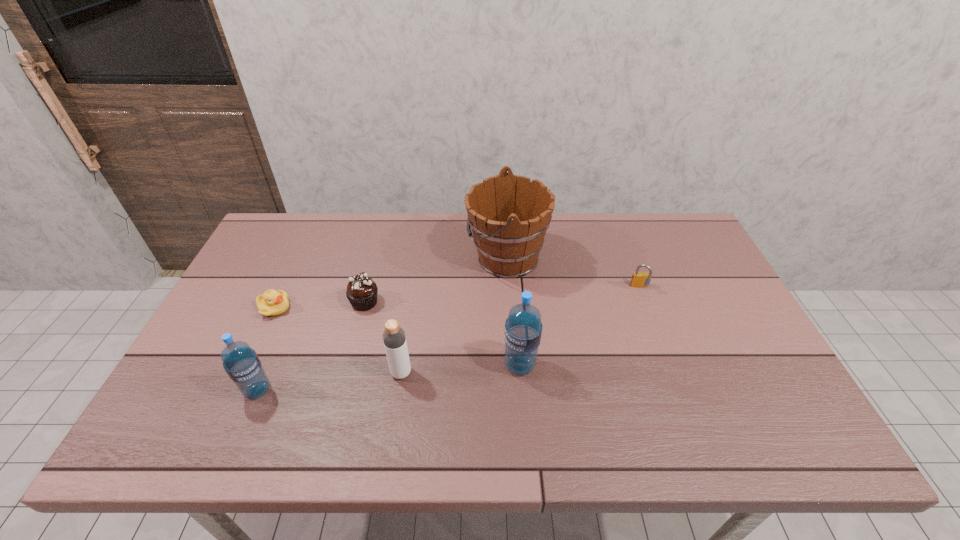
Image resolution: width=960 pixels, height=540 pixels. In order to click on free space located 0.300m with the handle on the wine bucket in this screenshot , I will do `click(372, 258)`.

Where is `vacant region located with the handle on the wine bucket`? The image size is (960, 540). vacant region located with the handle on the wine bucket is located at coordinates (416, 258).

Locate an element on the screen. Image resolution: width=960 pixels, height=540 pixels. free space located on the right of the fifth object from right to left is located at coordinates (481, 302).

You are a GUI agent. You are given a task and a screenshot of the screen. Output one action in this format:
    pyautogui.click(x=<x>, y=<y>)
    Task: Click on the free space located at the face of the shortest object
    Image resolution: width=960 pixels, height=540 pixels.
    Given the screenshot: What is the action you would take?
    pyautogui.click(x=315, y=308)

Locate an element on the screen. Image resolution: width=960 pixels, height=540 pixels. vacant space located 0.060m on the side with the combination dials of the padlock is located at coordinates pyautogui.click(x=647, y=307).

The width and height of the screenshot is (960, 540). What are the coordinates of `free space located on the back of the fourth object from left to right` in the screenshot? It's located at (407, 336).

The height and width of the screenshot is (540, 960). Find the location of `object present at the far edge`. object present at the far edge is located at coordinates (509, 215).

Find the location of a particular element. Image resolution: width=960 pixels, height=540 pixels. bottle that is at the near edge is located at coordinates (394, 339).

The image size is (960, 540). What are the coordinates of `water bottle that is at the left edge` in the screenshot? It's located at (241, 363).

Find the location of `duckling at the left edge`. duckling at the left edge is located at coordinates (272, 303).